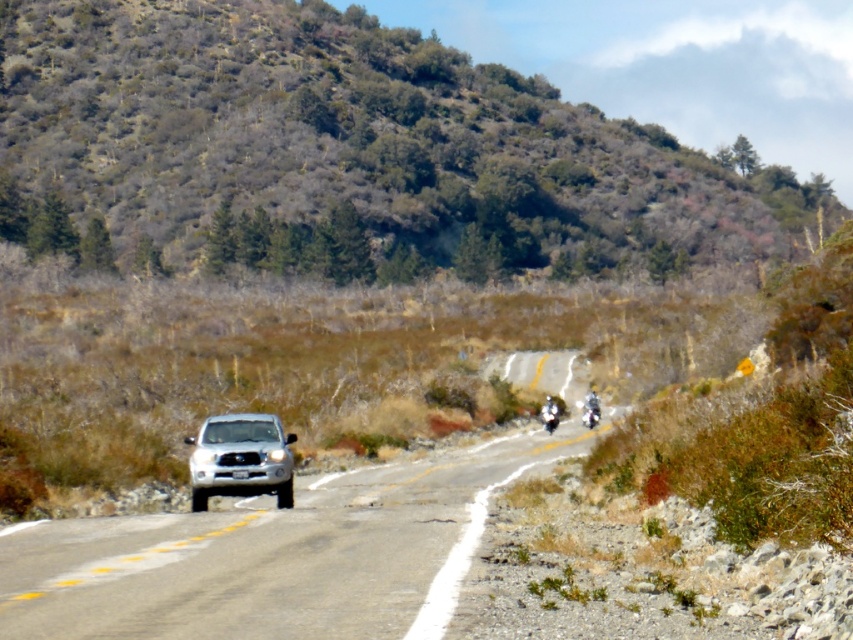
Question: Which of the following is the farthest from the observer?

Choices:
 (A) (585, 408)
 (B) (502, 481)
 (C) (596, 412)

Answer: (A)

Question: Which object is closer to the camera taking this photo?

Choices:
 (A) satin silver suv at center
 (B) shiny silver motorcycle at right

Answer: (A)

Question: Is green shrubbery at upper center to the left of shiny silver motorcycle at right from the viewer's perspective?

Choices:
 (A) yes
 (B) no

Answer: (B)

Question: Is white glossy motorcycle at center-right above shiny silver motorcycle at center-right?

Choices:
 (A) yes
 (B) no

Answer: (B)

Question: Does satin silver suv at center appear under shiny silver motorcycle at right?

Choices:
 (A) no
 (B) yes

Answer: (A)

Question: Which point is farther from the camera taking this photo?

Choices:
 (A) (257, 432)
 (B) (412, 540)
 (C) (583, 412)

Answer: (C)